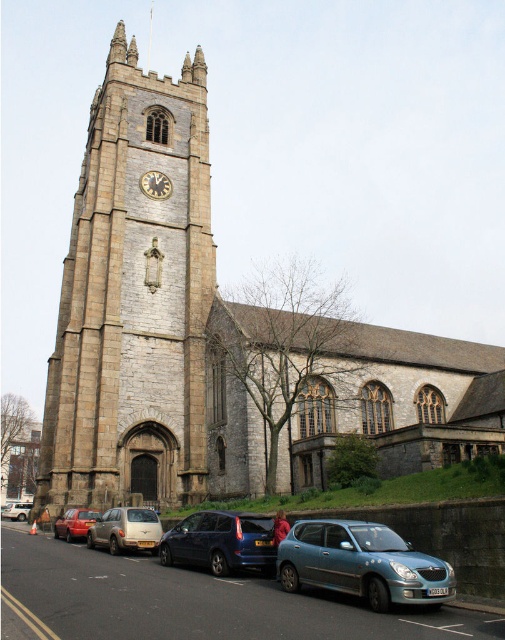
Can you confirm if metallic blue van at center is positioned to the left of silver metallic van at lower left?

Incorrect, metallic blue van at center is not on the left side of silver metallic van at lower left.

Locate an element on the screen. The height and width of the screenshot is (640, 505). metallic blue van at center is located at coordinates (221, 541).

Can you confirm if stone clock tower at center is bigger than metallic blue hatchback at lower center?

Correct, stone clock tower at center is larger in size than metallic blue hatchback at lower center.

In the scene shown: Does stone clock tower at center appear on the left side of metallic blue hatchback at lower center?

Correct, you'll find stone clock tower at center to the left of metallic blue hatchback at lower center.

Does point (191, 72) come behind point (327, 560)?

That is True.

Where is `stone clock tower at center`? stone clock tower at center is located at coordinates (133, 298).

Looking at this image, who is taller, silver metallic hatchback at center or gold metallic clock at center?

With more height is silver metallic hatchback at center.

Is the position of silver metallic hatchback at center more distant than that of gold metallic clock at center?

No, it is not.

Does point (149, 516) lie behind point (162, 193)?

No.

The image size is (505, 640). I want to click on silver metallic hatchback at center, so [126, 529].